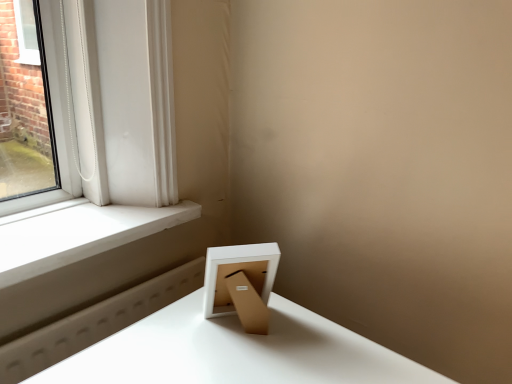
Find the location of a particular element. blank space situated above white smooth window sill at left (from a real-world perspective) is located at coordinates (78, 222).